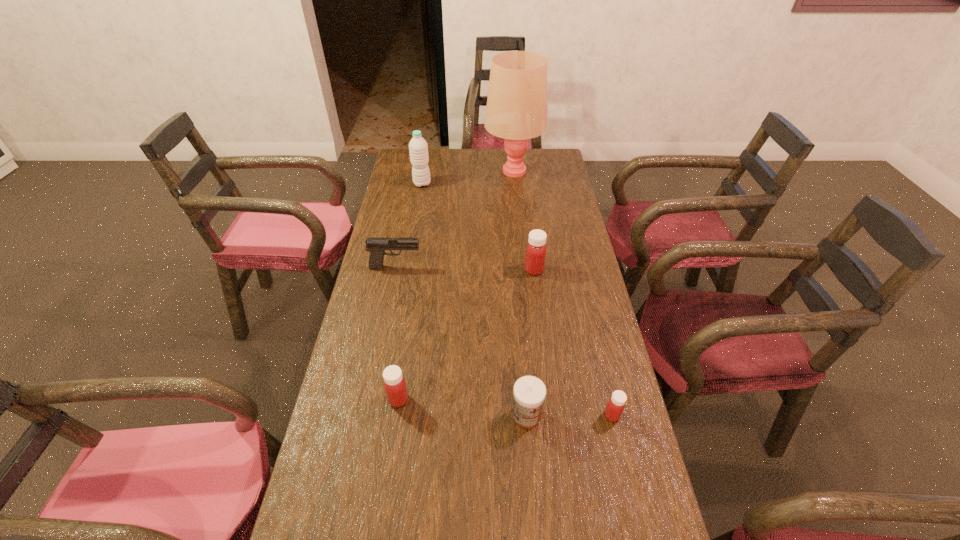
At what (x,y) coordinates should I click in order to perform the action: click on empty location between the white water bottle and the white medicine. Please return your answer as a coordinate pair (x, y). Looking at the image, I should click on (474, 300).

Image resolution: width=960 pixels, height=540 pixels. In order to click on vacant point located between the tallest object and the tallest medicine in this screenshot , I will do `click(523, 220)`.

Find the location of a particular element. This screenshot has width=960, height=540. free space between the white water bottle and the pistol is located at coordinates (409, 225).

The height and width of the screenshot is (540, 960). What are the coordinates of `free space between the white medicine and the leftmost red medicine` in the screenshot? It's located at (463, 408).

What are the coordinates of `free space between the water bottle and the leftmost medicine` in the screenshot? It's located at (410, 292).

Locate an element on the screen. free spot between the rightmost medicine and the pink lampshade is located at coordinates (563, 293).

Find the location of a particular element. The height and width of the screenshot is (540, 960). free space between the pistol and the tallest object is located at coordinates (454, 219).

At what (x,y) coordinates should I click in order to perform the action: click on the closest object relative to the second red medicine from left to right. Please return your answer as a coordinate pair (x, y). This screenshot has width=960, height=540. Looking at the image, I should click on click(376, 246).

Find the location of a particular element. This screenshot has height=540, width=960. the closest object to the pistol is located at coordinates (535, 255).

Identify which medicine is the closest to the white medicine. Please provide its 2D coordinates. Your answer should be formatted as a tuple, i.e. [(x, y)], where the tuple contains the x and y coordinates of a point satisfying the conditions above.

[(616, 404)]